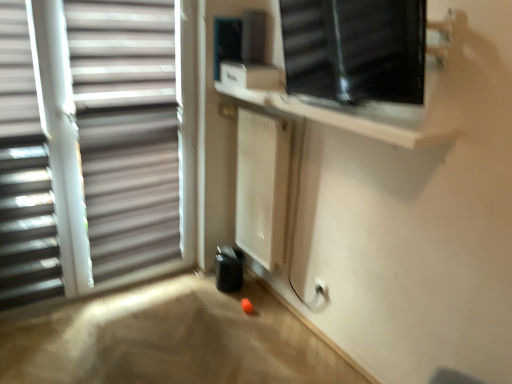
Locate an element on the screen. The height and width of the screenshot is (384, 512). free space on the front side of white matte window blind at left is located at coordinates (25, 336).